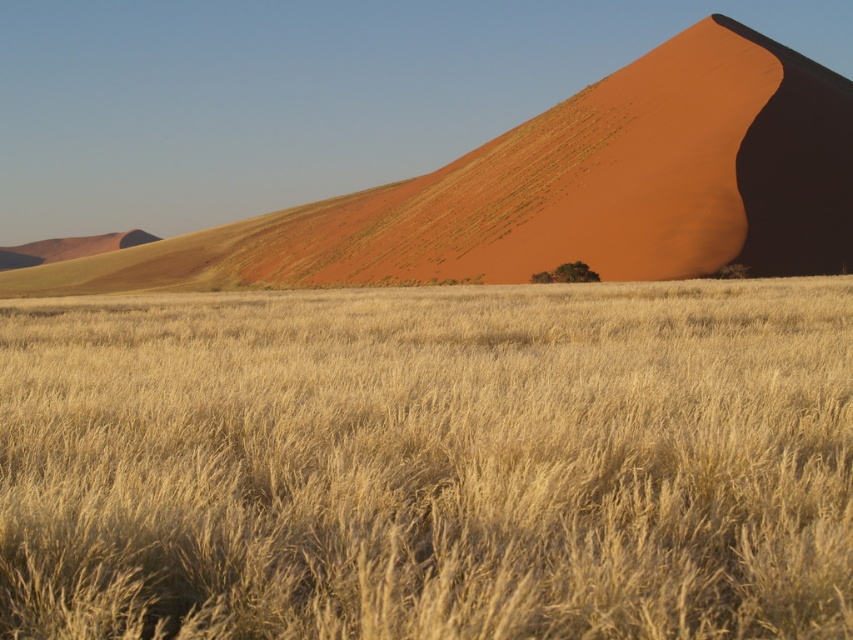
Question: Does golden grass at center have a smaller size compared to smooth sand dune at upper right?

Choices:
 (A) no
 (B) yes

Answer: (B)

Question: Is golden grass at center to the right of smooth sand dune at upper right from the viewer's perspective?

Choices:
 (A) no
 (B) yes

Answer: (B)

Question: Which point is farther to the camera?

Choices:
 (A) (688, 33)
 (B) (334, 502)

Answer: (A)

Question: Considering the relative positions of golden grass at center and smooth sand dune at upper right in the image provided, where is golden grass at center located with respect to smooth sand dune at upper right?

Choices:
 (A) below
 (B) above

Answer: (A)